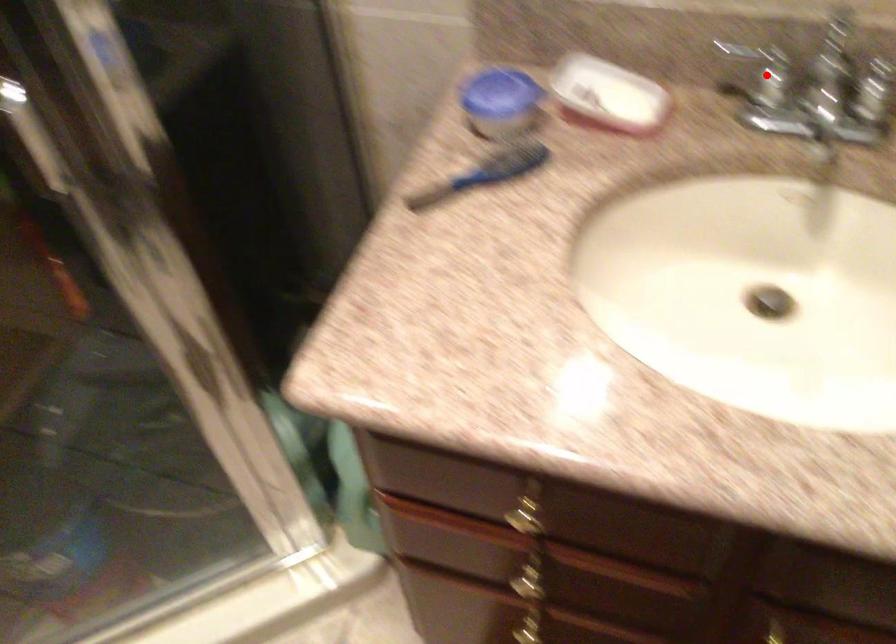
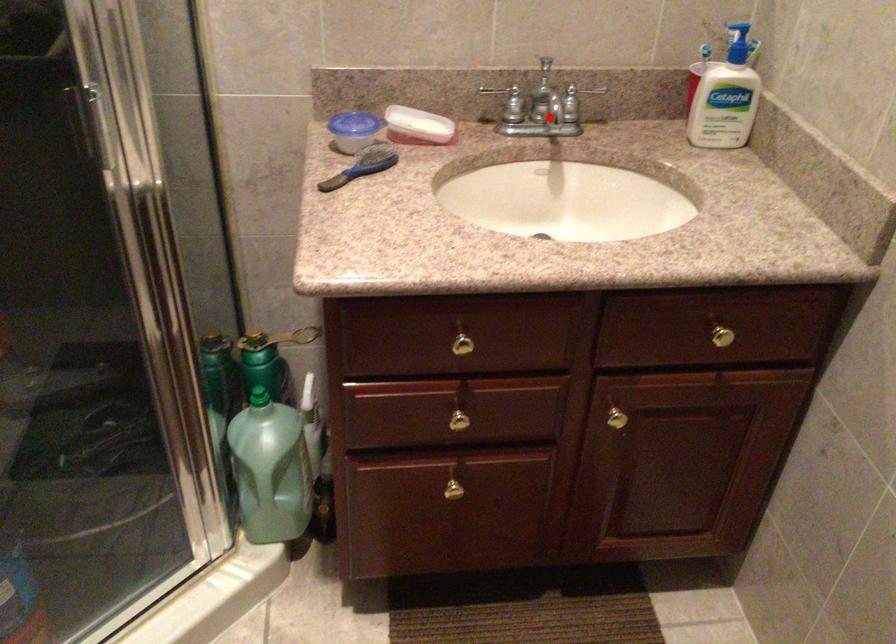
I am providing you with two images of the same scene from different viewpoints. A red point is marked on the first image and another point is marked on the second image. Do the highlighted points in image1 and image2 indicate the same real-world spot?

No